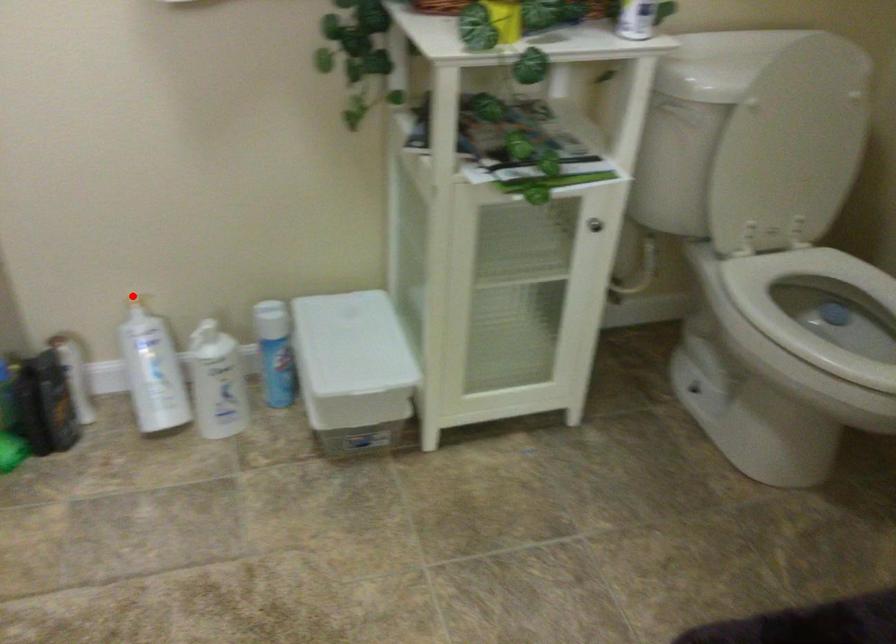
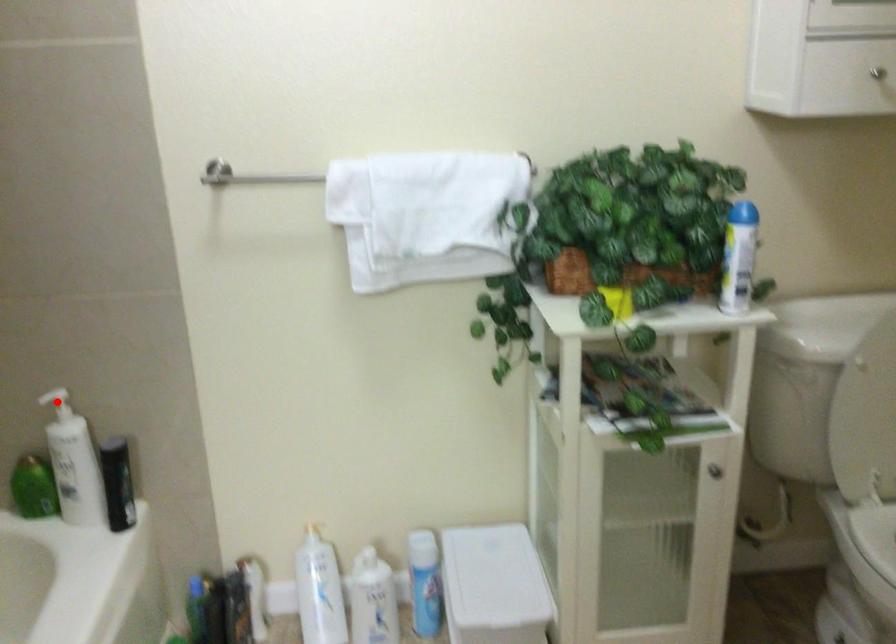
I am providing you with two images of the same scene from different viewpoints. A red point is marked on the first image and another point is marked on the second image. Are the points marked in image1 and image2 representing the same 3D position?

No